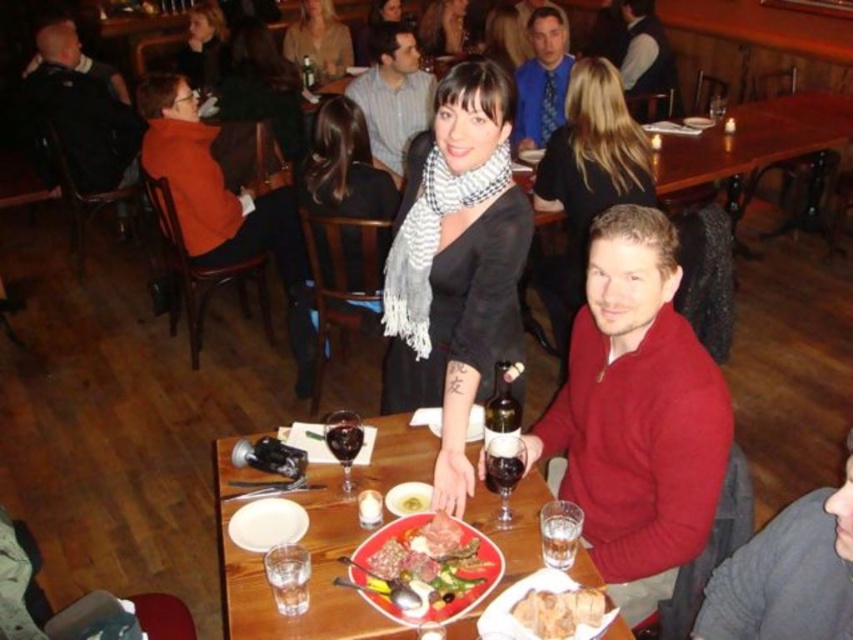
Image resolution: width=853 pixels, height=640 pixels. What do you see at coordinates (560, 532) in the screenshot? I see `clear glass wine at table center` at bounding box center [560, 532].

Who is taller, clear glass wine at table center or transparent glass at center?

transparent glass at center

Who is more distant from viewer, (x=560, y=532) or (x=340, y=413)?

Point (x=340, y=413)

Identify the location of clear glass wine at table center. (560, 532).

Between blue silk tie at upper center and dark glass wine at table center, which one is positioned higher?

blue silk tie at upper center is above.

Can you confirm if blue silk tie at upper center is shorter than dark glass wine at table center?

No.

Is point (550, 106) closer to viewer compared to point (514, 458)?

No, (550, 106) is behind (514, 458).

I want to click on blue silk tie at upper center, so click(543, 80).

Locate an element on the screen. matte beige sweater at upper center is located at coordinates point(318,40).

Is point (318, 49) behind point (457, 44)?

No, it is in front of (457, 44).

Find the location of a particular element. Image resolution: width=853 pixels, height=640 pixels. matte beige sweater at upper center is located at coordinates (318, 40).

The height and width of the screenshot is (640, 853). In order to click on matte beige sweater at upper center in this screenshot , I will do pos(318,40).